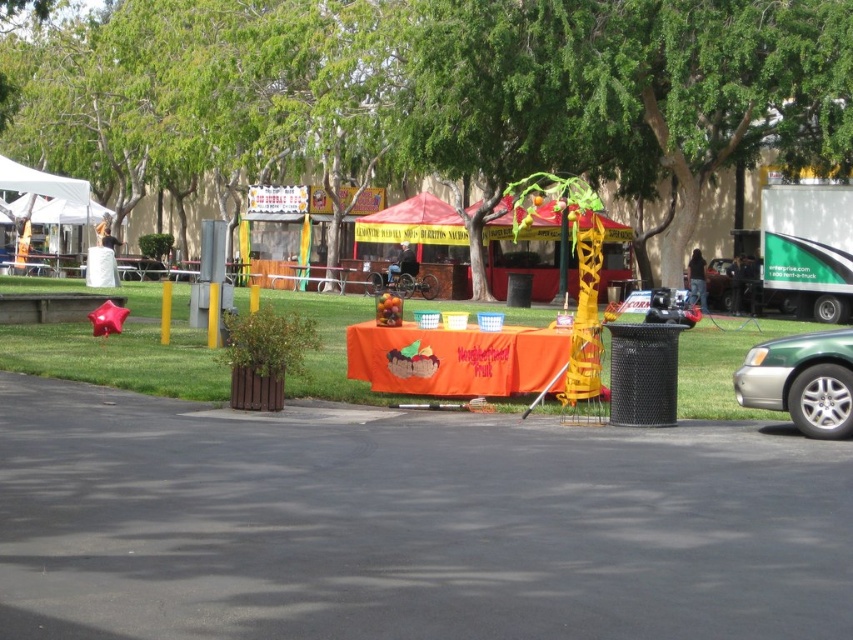
Which is behind, point (546, 28) or point (786, 349)?

Point (546, 28)

From the picture: Does green leafy tree at center come in front of green metallic car at lower right?

No, it is not.

Where is `green leafy tree at center`? The height and width of the screenshot is (640, 853). green leafy tree at center is located at coordinates (440, 90).